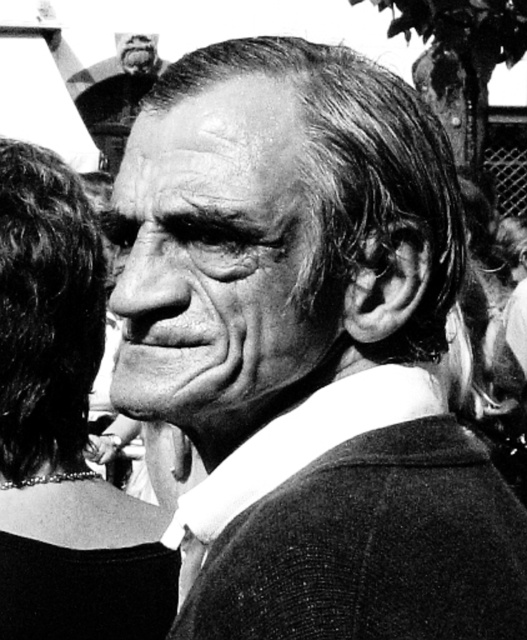
Can you confirm if smooth skin face at center is positioned below smooth black hair at left?

No.

Who is positioned more to the right, smooth skin face at center or smooth black hair at left?

smooth skin face at center

This screenshot has width=527, height=640. I want to click on smooth skin face at center, so click(x=219, y=260).